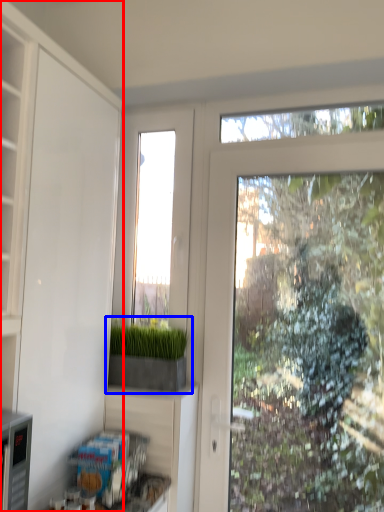
Question: Which of the following is the closest to the observer, cabinetry (highlighted by a red box) or houseplant (highlighted by a blue box)?

Choices:
 (A) cabinetry
 (B) houseplant

Answer: (A)